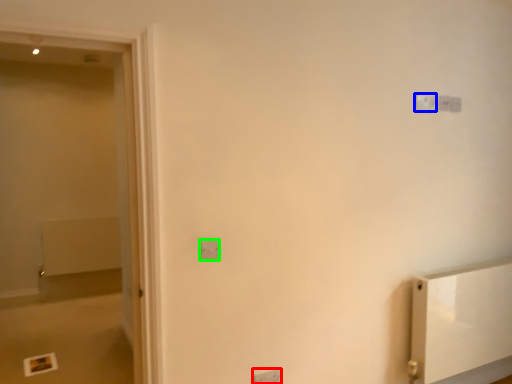
Question: Considering the real-world distances, which object is closest to light switch (highlighted by a red box)? light switch (highlighted by a blue box) or light switch (highlighted by a green box).

Choices:
 (A) light switch
 (B) light switch

Answer: (B)